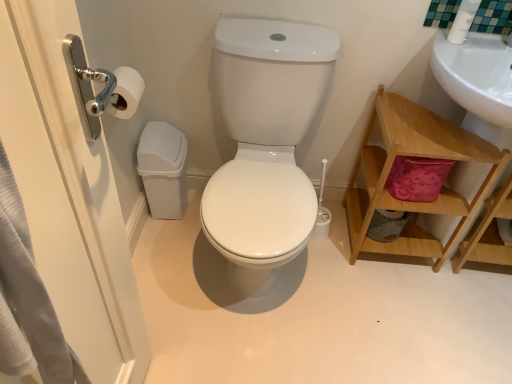
Question: Would you say wooden shelf at right contains brushed metal door handle at left?

Choices:
 (A) no
 (B) yes

Answer: (A)

Question: Does wooden shelf at right have a smaller size compared to brushed metal door handle at left?

Choices:
 (A) yes
 (B) no

Answer: (B)

Question: From a real-world perspective, is wooden shelf at right on top of brushed metal door handle at left?

Choices:
 (A) no
 (B) yes

Answer: (A)

Question: Could you tell me if wooden shelf at right is turned towards brushed metal door handle at left?

Choices:
 (A) yes
 (B) no

Answer: (B)

Question: Is wooden shelf at right to the left of brushed metal door handle at left from the viewer's perspective?

Choices:
 (A) yes
 (B) no

Answer: (B)

Question: Can you confirm if wooden shelf at right is taller than brushed metal door handle at left?

Choices:
 (A) no
 (B) yes

Answer: (A)

Question: Can you confirm if wooden shelf at right is wider than white glossy toilet at center?

Choices:
 (A) no
 (B) yes

Answer: (A)

Question: From a real-world perspective, is wooden shelf at right on white glossy toilet at center?

Choices:
 (A) no
 (B) yes

Answer: (A)

Question: Is white glossy toilet at center surrounded by wooden shelf at right?

Choices:
 (A) no
 (B) yes

Answer: (A)

Question: Does wooden shelf at right lie behind white glossy toilet at center?

Choices:
 (A) no
 (B) yes

Answer: (B)

Question: Considering the relative sizes of wooden shelf at right and white glossy toilet at center in the image provided, is wooden shelf at right smaller than white glossy toilet at center?

Choices:
 (A) no
 (B) yes

Answer: (B)

Question: Is wooden shelf at right not near white glossy toilet at center?

Choices:
 (A) no
 (B) yes

Answer: (A)

Question: Is white glossy toilet at center thinner than wooden shelf at right?

Choices:
 (A) yes
 (B) no

Answer: (B)